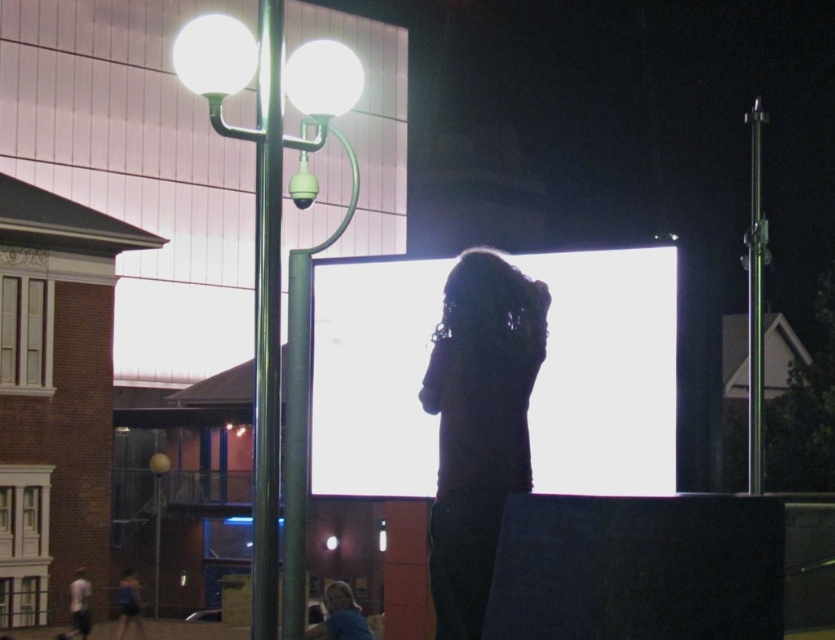
Is white glossy projection screen at center smaller than metallic pole at center-left?

Yes.

Is white glossy projection screen at center thinner than metallic pole at center-left?

No, white glossy projection screen at center is not thinner than metallic pole at center-left.

Is point (434, 483) positioned in front of point (277, 324)?

That is False.

This screenshot has height=640, width=835. I want to click on white glossy projection screen at center, so click(605, 372).

Is white glossy projection screen at center further to the viewer compared to metallic silver pole at left?

No, it is in front of metallic silver pole at left.

Find the location of `white glossy projection screen at center`. white glossy projection screen at center is located at coordinates (605, 372).

Between metallic pole at center and metallic silver pole at left, which one has less height?

metallic silver pole at left is shorter.

Image resolution: width=835 pixels, height=640 pixels. I want to click on metallic pole at center, so click(271, 211).